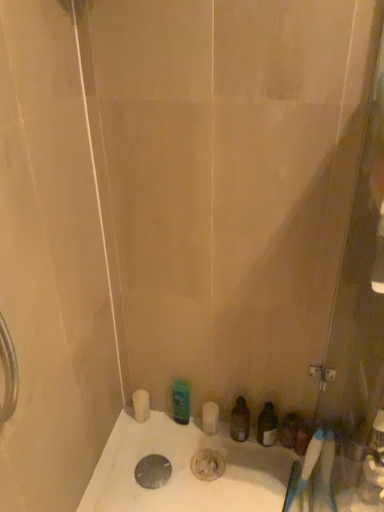
What is the approximate height of translucent plastic bottle at lower center, which appears as the 2th toiletry when viewed from the right?

It is 7.46 inches.

Identify the location of translucent plastic soap dispenser at lower right, positioned as the first toiletry in right-to-left order. The image size is (384, 512). (289, 430).

What do you see at coordinates (153, 471) in the screenshot? I see `metallic silver drain at bottom center` at bounding box center [153, 471].

Find the location of `translucent plastic bottle at lower center, which appears as the 2th toiletry when viewed from the right`. translucent plastic bottle at lower center, which appears as the 2th toiletry when viewed from the right is located at coordinates (240, 420).

Is green matte bottle at center, marked as the third toiletry in a right-to-left arrangement, shorter than metallic silver drain at bottom center?

No.

Is green matte bottle at center, marked as the third toiletry in a right-to-left arrangement, thinner than metallic silver drain at bottom center?

Indeed, green matte bottle at center, marked as the third toiletry in a right-to-left arrangement, has a lesser width compared to metallic silver drain at bottom center.

Which point is more forward, (184,395) or (166,460)?

The point (166,460) is closer.

Does green matte bottle at center, the 1th toiletry in the left-to-right sequence, appear on the right side of metallic silver drain at bottom center?

Indeed, green matte bottle at center, the 1th toiletry in the left-to-right sequence, is positioned on the right side of metallic silver drain at bottom center.

From a real-world perspective, who is located higher, translucent plastic soap dispenser at lower right, the third toiletry in the left-to-right sequence, or translucent plastic bottle at lower center, the second toiletry from the left?

From a 3D spatial view, translucent plastic bottle at lower center, the second toiletry from the left, is above.

Is point (291, 438) less distant than point (241, 435)?

Yes.

Does translucent plastic soap dispenser at lower right, the third toiletry in the left-to-right sequence, have a lesser width compared to translucent plastic bottle at lower center, the second toiletry from the left?

In fact, translucent plastic soap dispenser at lower right, the third toiletry in the left-to-right sequence, might be wider than translucent plastic bottle at lower center, the second toiletry from the left.

Is translucent plastic bottle at lower center, which appears as the 2th toiletry when viewed from the right, touching metallic silver drain at bottom center?

No.

Does translucent plastic bottle at lower center, which appears as the 2th toiletry when viewed from the right, contain metallic silver drain at bottom center?

That's incorrect, metallic silver drain at bottom center is not inside translucent plastic bottle at lower center, which appears as the 2th toiletry when viewed from the right.

Which is in front, point (232, 423) or point (150, 466)?

The point (150, 466) is in front.

Which is nearer, (301, 472) or (293, 434)?

Point (301, 472) appears to be closer to the viewer than point (293, 434).

What's the angular difference between white plastic toothbrush at lower right and translucent plastic soap dispenser at lower right, the third toiletry in the left-to-right sequence,'s facing directions?

The angular difference between white plastic toothbrush at lower right and translucent plastic soap dispenser at lower right, the third toiletry in the left-to-right sequence, is 12.5 degrees.

Where is `brush on the left of the translucent plastic soap dispenser at lower right, positioned as the first toiletry in right-to-left order`? The width and height of the screenshot is (384, 512). brush on the left of the translucent plastic soap dispenser at lower right, positioned as the first toiletry in right-to-left order is located at coordinates (303, 477).

Which is more to the left, white plastic toothbrush at lower right or translucent plastic soap dispenser at lower right, the third toiletry in the left-to-right sequence?

white plastic toothbrush at lower right.

Is white matte toilet paper at lower left placed right next to metallic silver drain at bottom center?

No, white matte toilet paper at lower left is not in contact with metallic silver drain at bottom center.

Find the location of a particular element. This screenshot has width=384, height=512. toilet paper located on the left of metallic silver drain at bottom center is located at coordinates (141, 405).

Is white matte toilet paper at lower left smaller than metallic silver drain at bottom center?

No.

Does white matte toilet paper at lower left have a greater height compared to metallic silver drain at bottom center?

Yes, white matte toilet paper at lower left is taller than metallic silver drain at bottom center.

Are translucent plastic soap dispenser at lower right, the third toiletry in the left-to-right sequence, and metallic silver drain at bottom center making contact?

There is a gap between translucent plastic soap dispenser at lower right, the third toiletry in the left-to-right sequence, and metallic silver drain at bottom center.

Looking at this image, does translucent plastic soap dispenser at lower right, positioned as the first toiletry in right-to-left order, have a greater width compared to metallic silver drain at bottom center?

Incorrect, the width of translucent plastic soap dispenser at lower right, positioned as the first toiletry in right-to-left order, does not surpass that of metallic silver drain at bottom center.

Is translucent plastic soap dispenser at lower right, positioned as the first toiletry in right-to-left order, to the left of metallic silver drain at bottom center from the viewer's perspective?

Incorrect, translucent plastic soap dispenser at lower right, positioned as the first toiletry in right-to-left order, is not on the left side of metallic silver drain at bottom center.

From a real-world perspective, is translucent plastic soap dispenser at lower right, the third toiletry in the left-to-right sequence, physically below metallic silver drain at bottom center?

No, from a real-world perspective, translucent plastic soap dispenser at lower right, the third toiletry in the left-to-right sequence, is not beneath metallic silver drain at bottom center.

Consider the image. Considering the sizes of objects translucent plastic bottle at lower center, the second toiletry from the left, and translucent plastic soap dispenser at lower right, the third toiletry in the left-to-right sequence, in the image provided, who is taller, translucent plastic bottle at lower center, the second toiletry from the left, or translucent plastic soap dispenser at lower right, the third toiletry in the left-to-right sequence,?

With more height is translucent plastic bottle at lower center, the second toiletry from the left.

Which of these two, translucent plastic bottle at lower center, the second toiletry from the left, or translucent plastic soap dispenser at lower right, positioned as the first toiletry in right-to-left order, is wider?

translucent plastic soap dispenser at lower right, positioned as the first toiletry in right-to-left order, is wider.

Is translucent plastic bottle at lower center, the second toiletry from the left, facing towards translucent plastic soap dispenser at lower right, positioned as the first toiletry in right-to-left order?

No, translucent plastic bottle at lower center, the second toiletry from the left, is not facing towards translucent plastic soap dispenser at lower right, positioned as the first toiletry in right-to-left order.

Can you confirm if translucent plastic bottle at lower center, the second toiletry from the left, is bigger than translucent plastic soap dispenser at lower right, the third toiletry in the left-to-right sequence?

Indeed, translucent plastic bottle at lower center, the second toiletry from the left, has a larger size compared to translucent plastic soap dispenser at lower right, the third toiletry in the left-to-right sequence.

From a real-world perspective, which toiletry is the 3rd one above the metallic silver drain at bottom center? Please provide its 2D coordinates.

[(180, 401)]

The height and width of the screenshot is (512, 384). I want to click on toiletry on the right side of translucent plastic bottle at lower center, which appears as the 2th toiletry when viewed from the right, so click(289, 430).

When comparing their distances from translucent plastic bottle at lower center, which appears as the 2th toiletry when viewed from the right, does white plastic toothbrush at lower right or green matte bottle at center, marked as the third toiletry in a right-to-left arrangement, seem further?

white plastic toothbrush at lower right lies further to translucent plastic bottle at lower center, which appears as the 2th toiletry when viewed from the right, than the other object.

When comparing their distances from green matte bottle at center, marked as the third toiletry in a right-to-left arrangement, does white plastic toothbrush at lower right or translucent plastic soap dispenser at lower right, positioned as the first toiletry in right-to-left order, seem further?

The object further to green matte bottle at center, marked as the third toiletry in a right-to-left arrangement, is white plastic toothbrush at lower right.

Estimate the real-world distances between objects in this image. Which object is further from translucent plastic soap dispenser at lower right, positioned as the first toiletry in right-to-left order, white plastic toothbrush at lower right or green matte bottle at center, the 1th toiletry in the left-to-right sequence?

The object further to translucent plastic soap dispenser at lower right, positioned as the first toiletry in right-to-left order, is green matte bottle at center, the 1th toiletry in the left-to-right sequence.

When comparing their distances from white matte toilet paper at lower left, does white plastic toothbrush at lower right or metallic silver drain at bottom center seem closer?

The object closer to white matte toilet paper at lower left is metallic silver drain at bottom center.

Considering their positions, is translucent plastic soap dispenser at lower right, the third toiletry in the left-to-right sequence, positioned closer to green matte bottle at center, the 1th toiletry in the left-to-right sequence, than metallic silver drain at bottom center?

metallic silver drain at bottom center is positioned closer to the anchor green matte bottle at center, the 1th toiletry in the left-to-right sequence.

Considering their positions, is translucent plastic soap dispenser at lower right, the third toiletry in the left-to-right sequence, positioned closer to translucent plastic bottle at lower center, the second toiletry from the left, than white matte toilet paper at lower left?

translucent plastic soap dispenser at lower right, the third toiletry in the left-to-right sequence, is positioned closer to the anchor translucent plastic bottle at lower center, the second toiletry from the left.

Estimate the real-world distances between objects in this image. Which object is further from white matte toilet paper at lower left, metallic silver drain at bottom center or translucent plastic soap dispenser at lower right, positioned as the first toiletry in right-to-left order?

The object further to white matte toilet paper at lower left is translucent plastic soap dispenser at lower right, positioned as the first toiletry in right-to-left order.

Considering their positions, is metallic silver drain at bottom center positioned closer to white matte toilet paper at lower left than translucent plastic bottle at lower center, the second toiletry from the left?

Among the two, metallic silver drain at bottom center is located nearer to white matte toilet paper at lower left.

Locate an element on the screen. drain located between white matte toilet paper at lower left and translucent plastic soap dispenser at lower right, the third toiletry in the left-to-right sequence, in the left-right direction is located at coordinates (153, 471).

Where is `toilet paper between green matte bottle at center, the 1th toiletry in the left-to-right sequence, and metallic silver drain at bottom center vertically`? toilet paper between green matte bottle at center, the 1th toiletry in the left-to-right sequence, and metallic silver drain at bottom center vertically is located at coordinates (141, 405).

In order to click on brush between metallic silver drain at bottom center and translucent plastic soap dispenser at lower right, positioned as the first toiletry in right-to-left order, in the horizontal direction in this screenshot , I will do `click(303, 477)`.

Identify the location of toiletry located between white plastic toothbrush at lower right and translucent plastic bottle at lower center, the second toiletry from the left, in the depth direction. (289, 430).